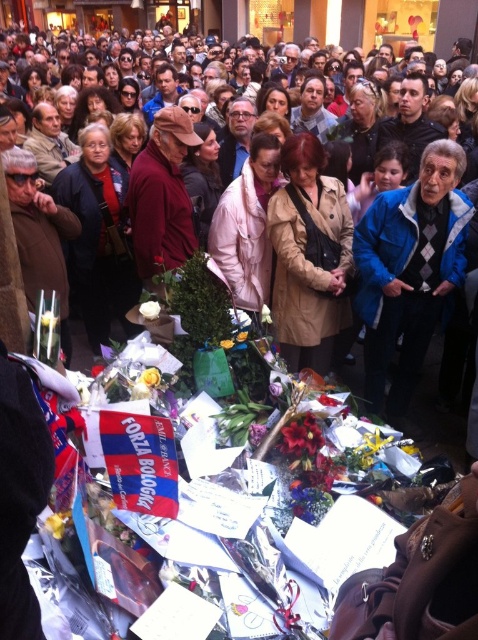
Does red silk flower at center appear under purple matte flower at lower center?

Actually, red silk flower at center is above purple matte flower at lower center.

Can you confirm if red silk flower at center is bigger than purple matte flower at lower center?

Yes.

Is point (306, 417) in front of point (259, 426)?

Yes, it is.

Where is `red silk flower at center`? The width and height of the screenshot is (478, 640). red silk flower at center is located at coordinates (301, 436).

Is yellow fabric flower at lower center closer to camera compared to white matte rose at center?

Yes, yellow fabric flower at lower center is closer to the viewer.

Who is positioned more to the right, yellow fabric flower at lower center or white matte rose at center?

yellow fabric flower at lower center

Where is `yellow fabric flower at lower center`? Image resolution: width=478 pixels, height=640 pixels. yellow fabric flower at lower center is located at coordinates (150, 378).

The width and height of the screenshot is (478, 640). Describe the element at coordinates (150, 310) in the screenshot. I see `white matte rose at center` at that location.

Where is `white matte rose at center`? The height and width of the screenshot is (640, 478). white matte rose at center is located at coordinates (150, 310).

Is point (153, 316) positioned after point (229, 344)?

No, it is not.

The height and width of the screenshot is (640, 478). In order to click on white matte rose at center in this screenshot , I will do `click(150, 310)`.